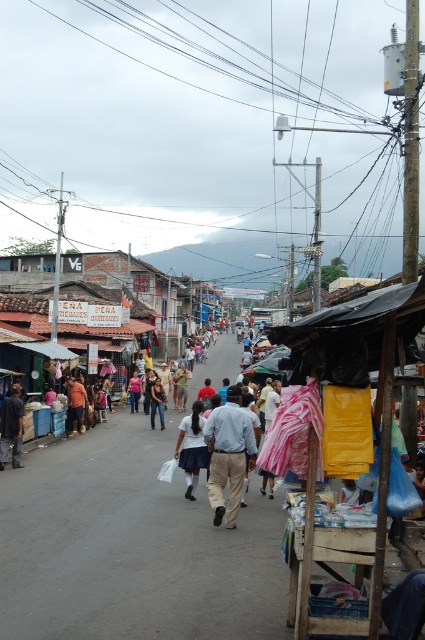
You are a fashion designer observing a woman in the market. You notice her wearing the white matte skirt at center and dark brown leather shoes at center. Which item is positioned higher on her body?

The white matte skirt at center is located above the dark brown leather shoes at center, so the skirt is higher on her body.

You are a photographer standing at the edge of the market. You see a person wearing a light blue shirt at center and dark brown leather shoes at center. Which object is positioned more to the right from your viewpoint?

The light blue shirt at center is positioned to the right of the dark brown leather shoes at center, so the light blue shirt at center is more to the right.

You are a customer at the market and see the white matte skirt at center and the dark blue dress at center. Which clothing item is covering the other one?

The white matte skirt at center is positioned over dark blue dress at center, so it is covering the dark blue dress at center.